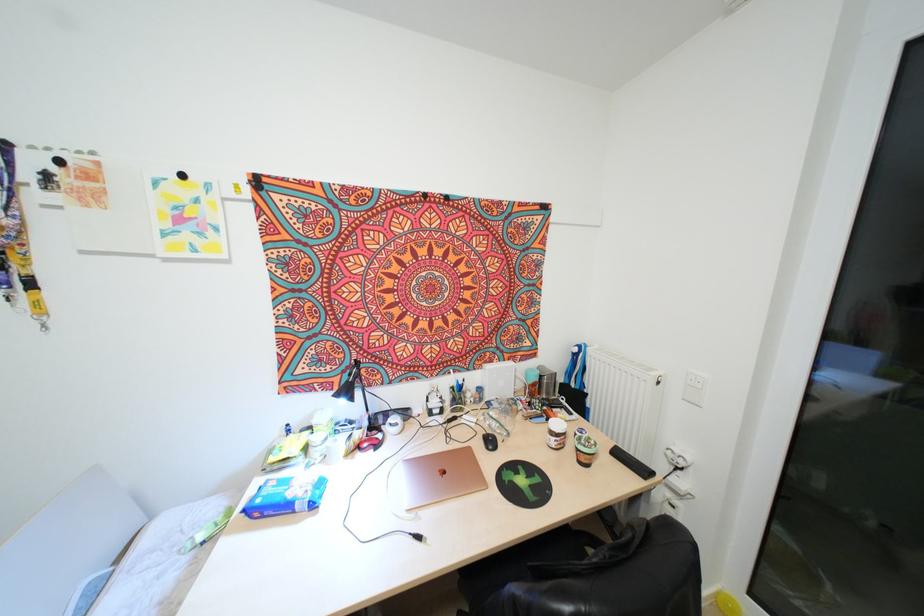
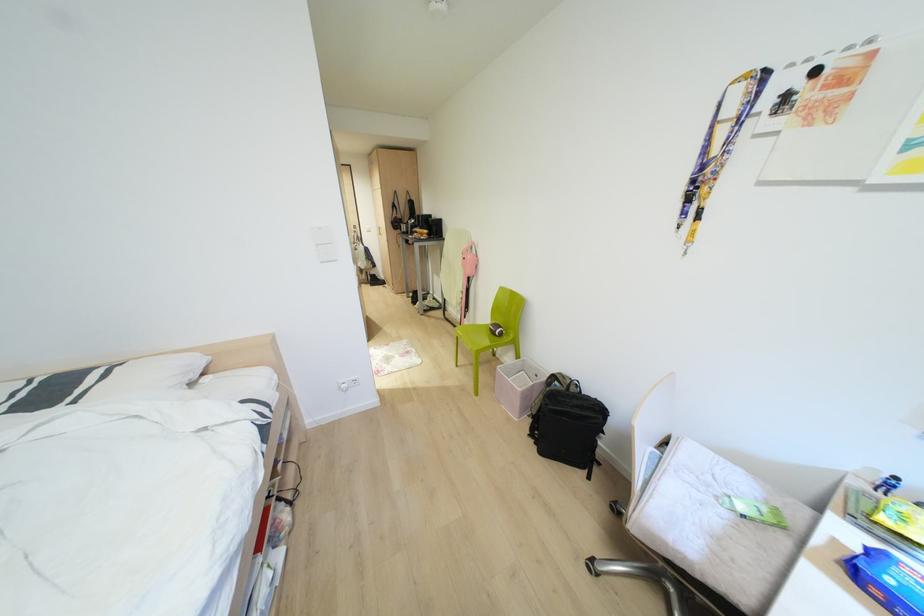
The first image is from the beginning of the video and the second image is from the end. How did the camera likely rotate when shooting the video?

The camera rotated toward left-down.